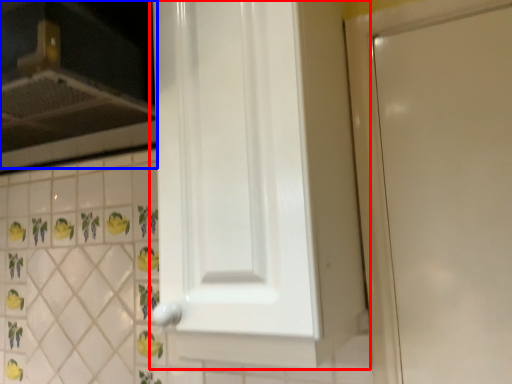
Question: Among these objects, which one is nearest to the camera, door (highlighted by a red box) or vent (highlighted by a blue box)?

Choices:
 (A) door
 (B) vent

Answer: (A)